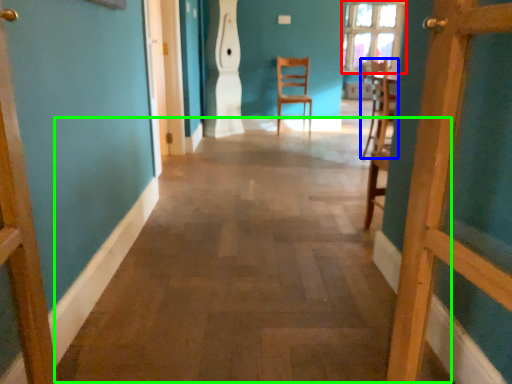
Question: Estimate the real-world distances between objects in this image. Which object is farther from window (highlighted by a red box), chair (highlighted by a blue box) or alley (highlighted by a green box)?

Choices:
 (A) chair
 (B) alley

Answer: (B)